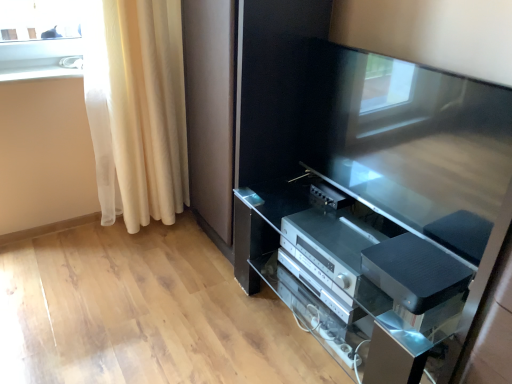
I want to click on free space in front of white sheer curtain at left, so click(137, 264).